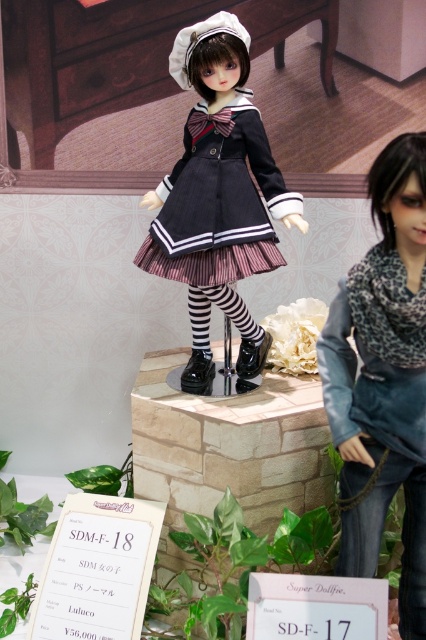
You are a customer in a doll store and want to buy a scarf and a dress. You see the leopard print scarf at right and the matte black dress at center. Which one is located to the right of the other?

The leopard print scarf at right is positioned on the right side of matte black dress at center.

You are a photographer trying to capture both dolls in a single shot. You notice two points marked in the image, point 1 at coordinates point (386, 477) and point 2 at coordinates point (176, 275). Which point is closer to your camera lens?

Point (386, 477) is closer to the camera lens than point (176, 275).

You are a customer in a boutique store and see the leopard print scarf at right and the matte black dress at center. Which item is positioned lower in the display?

The leopard print scarf at right is positioned below the matte black dress at center, so it is lower in the display.